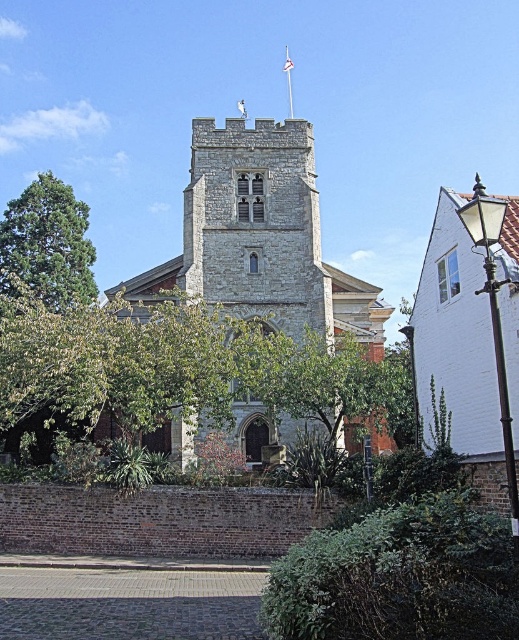
You are a landscape architect planning to plant a new tree in the churchyard. You notice the green leafy tree at center and the green leafy tree at left. Which tree has a narrower width?

The green leafy tree at center has a narrower width than the green leafy tree at left.